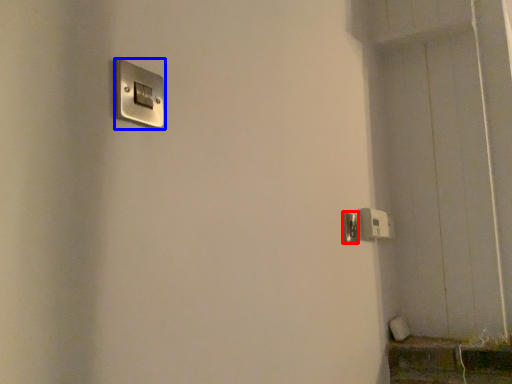
Question: Among these objects, which one is farthest to the camera, door handle (highlighted by a red box) or light switch (highlighted by a blue box)?

Choices:
 (A) door handle
 (B) light switch

Answer: (A)